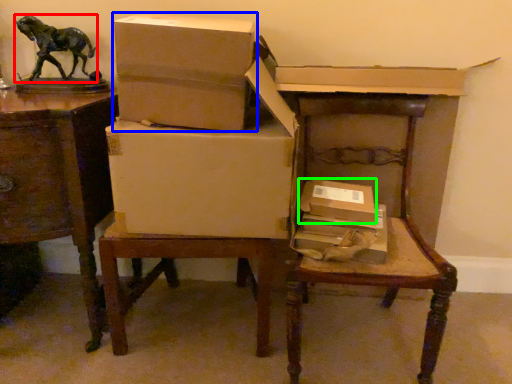
Question: Which object is positioned closest to animal (highlighted by a red box)? Select from box (highlighted by a blue box) and box (highlighted by a green box).

Choices:
 (A) box
 (B) box

Answer: (A)